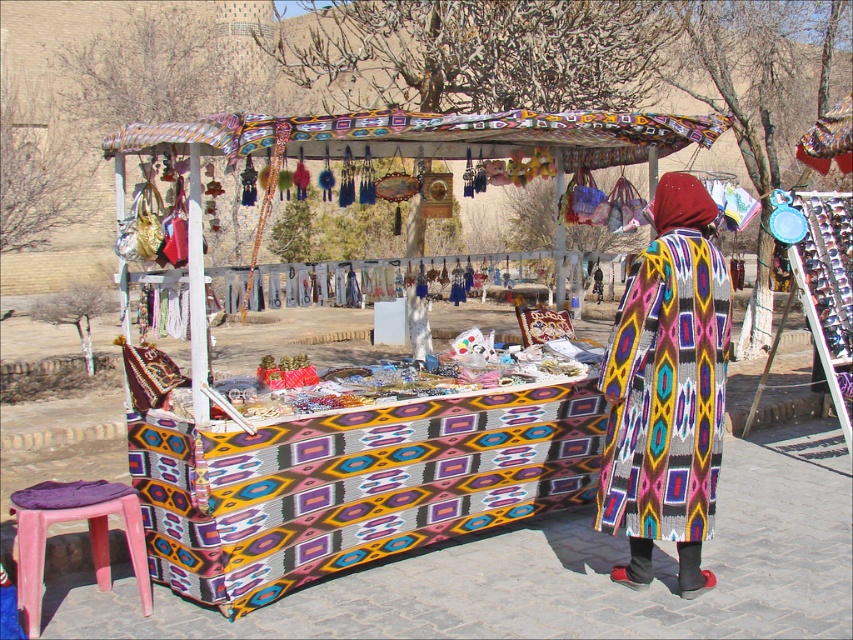
I want to click on knitted fabric stall at center, so pos(450,456).

Does knitted fabric stall at center have a lesser height compared to pink plastic stool at lower left?

In fact, knitted fabric stall at center may be taller than pink plastic stool at lower left.

Between point (177, 138) and point (25, 572), which one is positioned in front?

Point (177, 138) is in front.

Locate an element on the screen. knitted fabric stall at center is located at coordinates 450,456.

Can you confirm if knitted woolen shawl at center is shorter than pink plastic stool at lower left?

No, knitted woolen shawl at center is not shorter than pink plastic stool at lower left.

Does knitted woolen shawl at center appear on the right side of pink plastic stool at lower left?

Yes, knitted woolen shawl at center is to the right of pink plastic stool at lower left.

Locate an element on the screen. This screenshot has height=640, width=853. knitted woolen shawl at center is located at coordinates (666, 390).

Is knitted fabric stall at center wider than knitted woolen shawl at center?

Correct, the width of knitted fabric stall at center exceeds that of knitted woolen shawl at center.

I want to click on knitted fabric stall at center, so click(x=450, y=456).